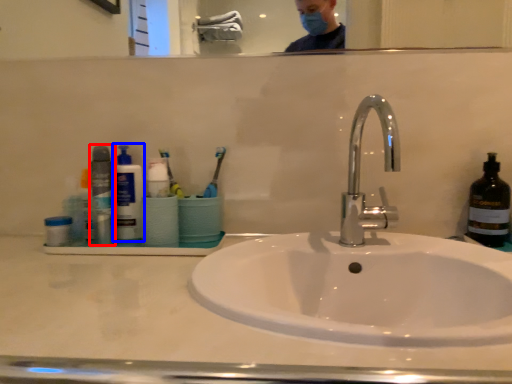
Question: Which point is closer to the camera, bottle (highlighted by a red box) or cleaning product (highlighted by a blue box)?

Choices:
 (A) bottle
 (B) cleaning product

Answer: (A)